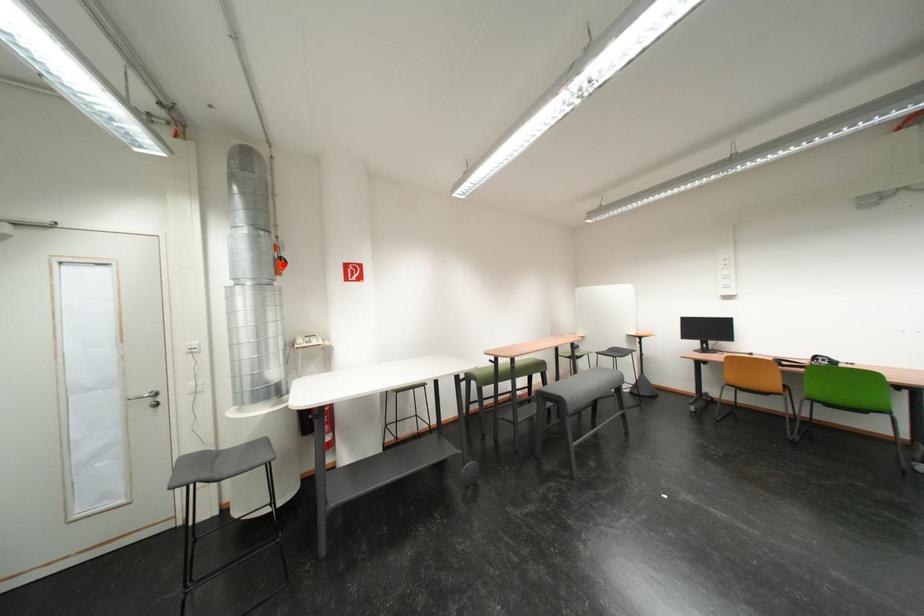
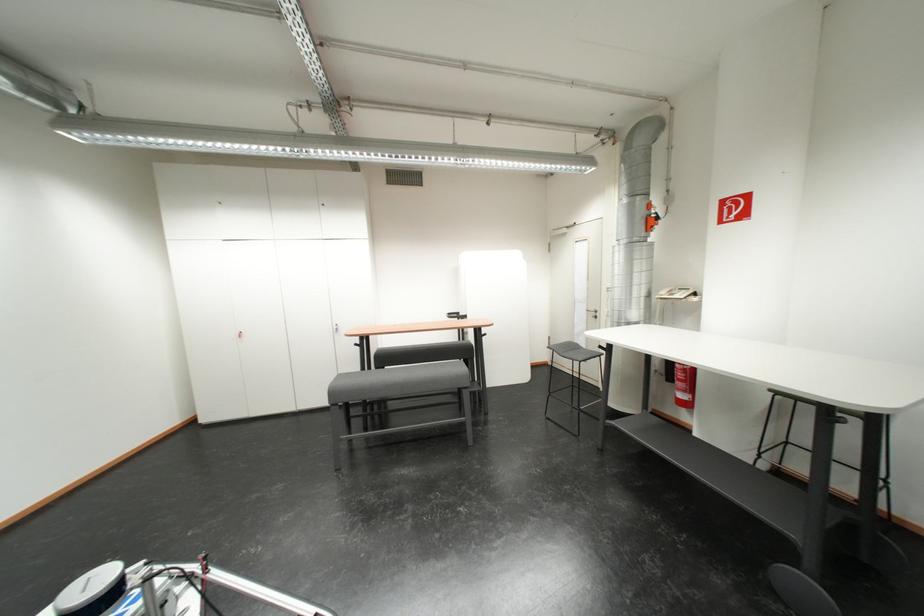
In the second image, find the point that corresponds to the highlighted location in the first image.

(654, 224)